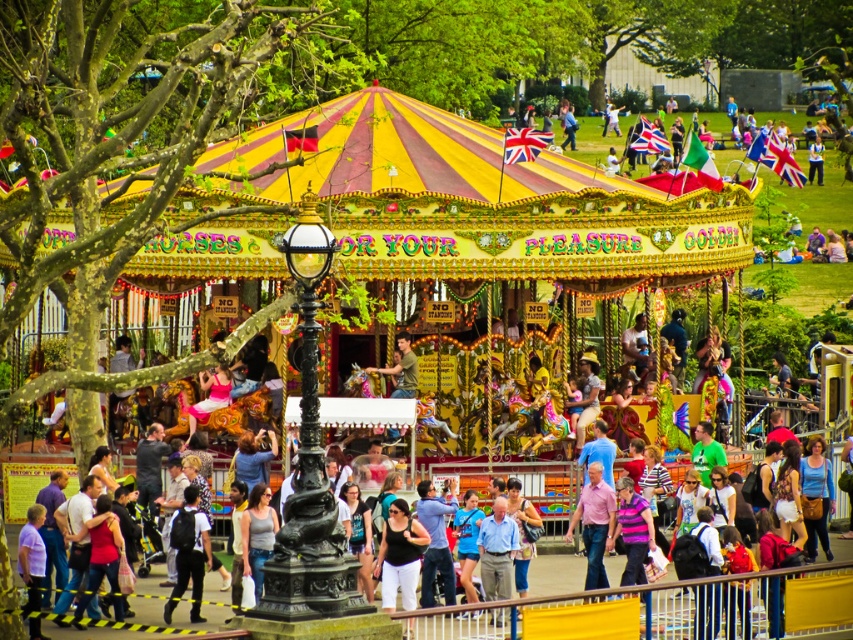
You are a photographer standing at the edge of the fairground. You want to take a photo of the carousel while including both the dark blue backpack at center and the pink cotton shirt at center in the frame. Which object should you ensure is closer to the camera to include both in the photo?

The dark blue backpack at center is in front of the pink cotton shirt at center. To include both in the photo, you should ensure the dark blue backpack at center is closer to the camera since it is already positioned in front of the pink cotton shirt at center.

You are a photographer trying to capture a clear shot of the pink cotton shirt at center without the dark blue backpack at center blocking it. Based on their positions, is this possible?

The dark blue backpack at center might be wider than pink cotton shirt at center, so there is a possibility that the backpack could block the view of the shirt. To ensure a clear shot, repositioning to the side or adjusting the angle might be necessary.